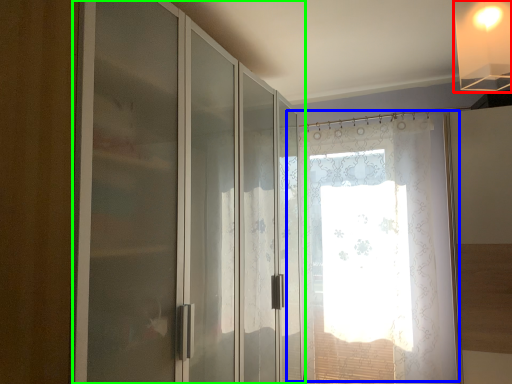
Question: Considering the real-world distances, which object is farthest from light fixture (highlighted by a red box)? window (highlighted by a blue box) or door (highlighted by a green box)?

Choices:
 (A) window
 (B) door

Answer: (A)